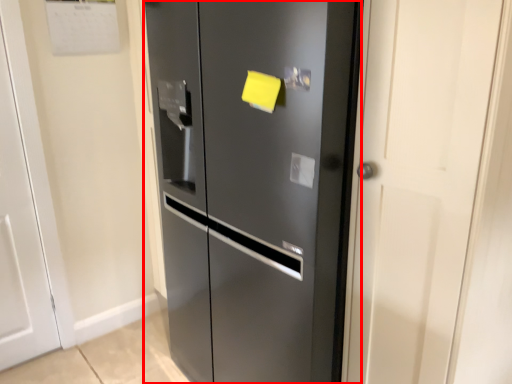
Question: From the image's perspective, where is door (annotated by the red box) located relative to door?

Choices:
 (A) below
 (B) above

Answer: (A)